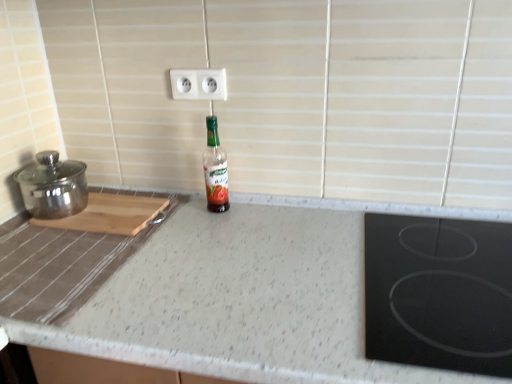
You are a GUI agent. You are given a task and a screenshot of the screen. Output one action in this format:
    pyautogui.click(x=<x>, y=<y>)
    Task: Click on the empty space that is to the right of wooden cutting board at left
    Image resolution: width=512 pixels, height=384 pixels.
    Given the screenshot: What is the action you would take?
    pyautogui.click(x=190, y=225)